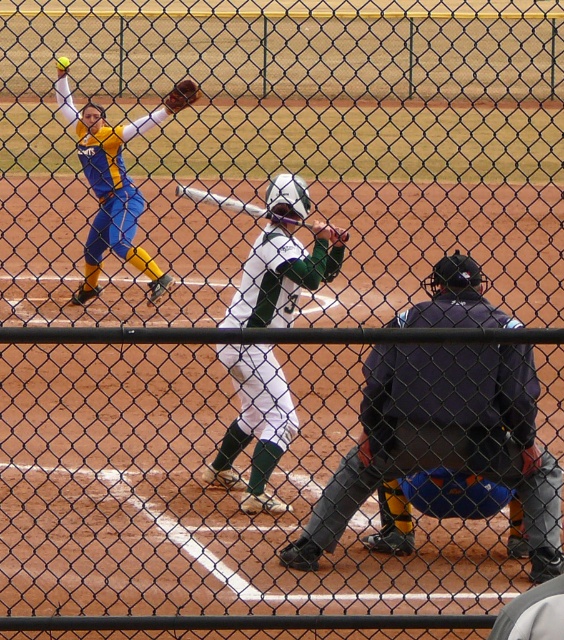
Question: Can you confirm if white matte uniform at center is smaller than brown leather glove at center?

Choices:
 (A) no
 (B) yes

Answer: (A)

Question: Is metallic silver bat at center to the left of yellow matte baseball at upper left from the viewer's perspective?

Choices:
 (A) yes
 (B) no

Answer: (B)

Question: Which object appears farthest from the camera in this image?

Choices:
 (A) white matte uniform at center
 (B) brown leather glove at center

Answer: (B)

Question: Which point is farther to the camera?

Choices:
 (A) (175, 86)
 (B) (68, 61)
 (C) (240, 211)

Answer: (B)

Question: Which of the following is the closest to the observer?

Choices:
 (A) white matte uniform at center
 (B) dark blue padded jacket at center
 (C) metallic silver bat at center
 (D) brown leather glove at center

Answer: (B)

Question: Considering the relative positions of dark blue padded jacket at center and brown leather glove at center in the image provided, where is dark blue padded jacket at center located with respect to brown leather glove at center?

Choices:
 (A) above
 (B) below

Answer: (B)